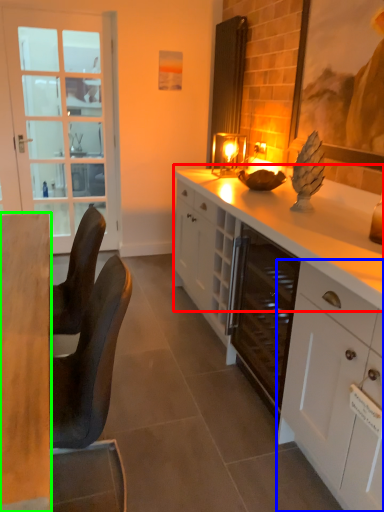
Question: Estimate the real-world distances between objects in this image. Which object is closer to countertop (highlighted by a red box), cabinetry (highlighted by a blue box) or desk (highlighted by a green box)?

Choices:
 (A) cabinetry
 (B) desk

Answer: (A)